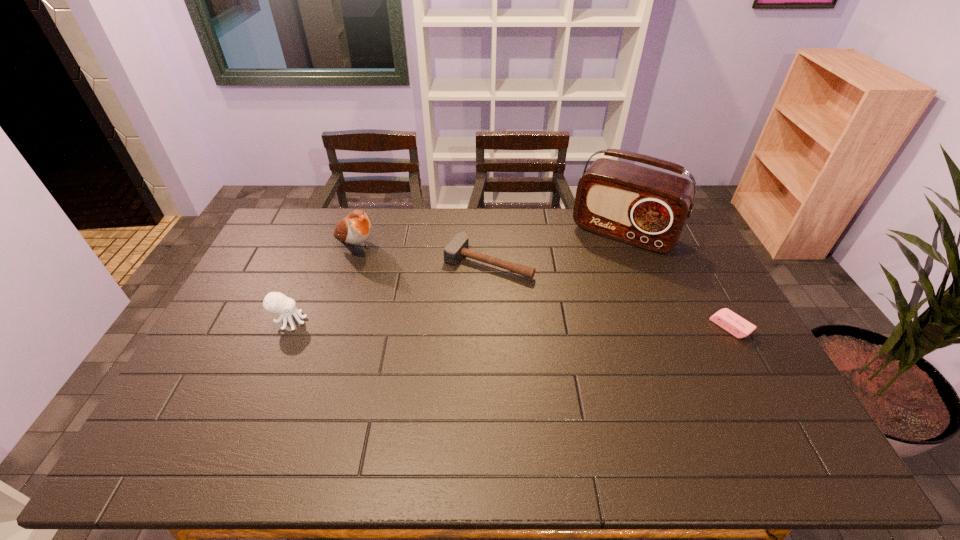
Find the location of a particular element. blank area located on the front panel of the tallest object is located at coordinates (600, 263).

Locate an element on the screen. The width and height of the screenshot is (960, 540). vacant space located 0.240m at the face of the bird is located at coordinates (413, 291).

Where is `free space located at the face of the bird`? This screenshot has height=540, width=960. free space located at the face of the bird is located at coordinates (403, 284).

Locate an element on the screen. The width and height of the screenshot is (960, 540). vacant space situated 0.190m at the face of the bird is located at coordinates (403, 284).

Where is `free space located on the striking surface of the fourth tallest object`? free space located on the striking surface of the fourth tallest object is located at coordinates (x=428, y=336).

Find the location of a particular element. Image resolution: width=960 pixels, height=540 pixels. free point located on the striking surface of the fourth tallest object is located at coordinates (448, 309).

Identify the location of vacant region located on the striking surface of the fourth tallest object. (458, 296).

Locate an element on the screen. This screenshot has height=540, width=960. radio receiver that is at the far edge is located at coordinates (647, 208).

The image size is (960, 540). Find the location of `bird positioned at the far edge`. bird positioned at the far edge is located at coordinates (355, 228).

The width and height of the screenshot is (960, 540). I want to click on hammer that is at the far edge, so click(x=458, y=247).